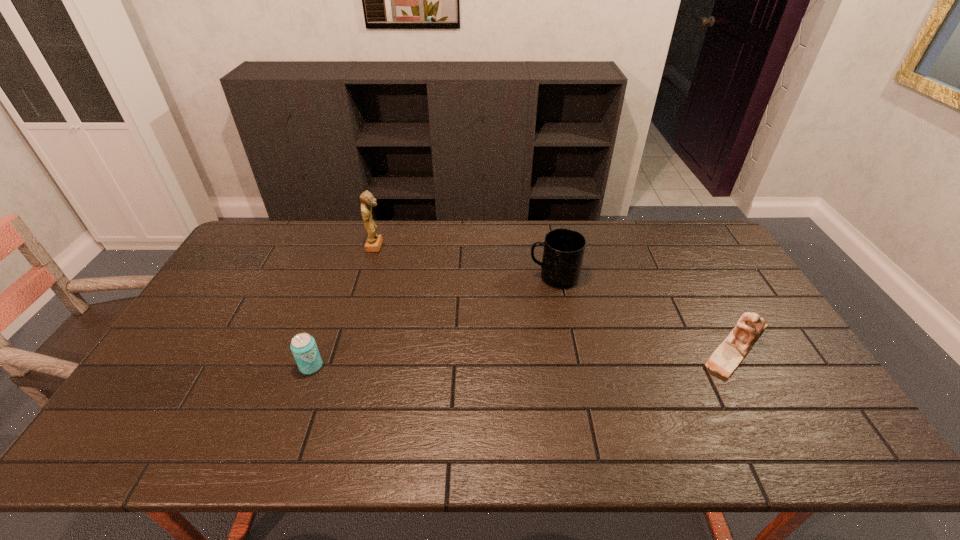
Locate an element on the screen. The height and width of the screenshot is (540, 960). free spot between the mug and the tallest object is located at coordinates (465, 261).

This screenshot has width=960, height=540. What are the coordinates of `free spot between the rightmost object and the third shortest object` in the screenshot? It's located at (645, 313).

Locate which object ranks second in proximity to the leftmost object. Please provide its 2D coordinates. Your answer should be formatted as a tuple, i.e. [(x, y)], where the tuple contains the x and y coordinates of a point satisfying the conditions above.

[(564, 248)]

In order to click on object that is the nearest to the leftmost object in this screenshot , I will do pyautogui.click(x=373, y=243).

The image size is (960, 540). Identify the location of free spot that satisfies the following two spatial constraints: 1. on the side of the second farthest object with the handle; 2. on the front side of the leftmost object. (571, 367).

At what (x,y) coordinates should I click in order to perform the action: click on vacant space that satisfies the following two spatial constraints: 1. on the front-facing side of the farthest object; 2. on the front side of the leftmost object. Please return your answer as a coordinate pair (x, y). Looking at the image, I should click on (340, 367).

Where is `vacant area in the image that satisfies the following two spatial constraints: 1. on the side of the mug with the handle; 2. on the front side of the beer can`? The height and width of the screenshot is (540, 960). vacant area in the image that satisfies the following two spatial constraints: 1. on the side of the mug with the handle; 2. on the front side of the beer can is located at coordinates (571, 367).